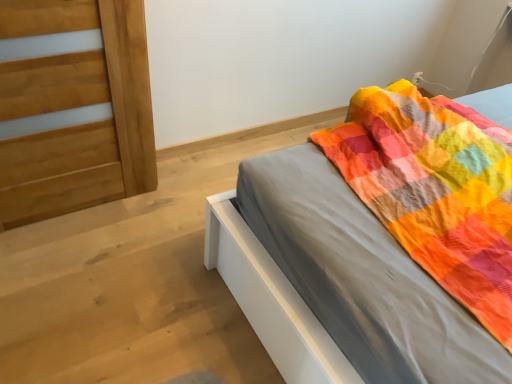
Identify the location of matte gray bed at center. The width and height of the screenshot is (512, 384). (337, 282).

The height and width of the screenshot is (384, 512). What do you see at coordinates (337, 282) in the screenshot?
I see `matte gray bed at center` at bounding box center [337, 282].

The image size is (512, 384). Find the location of `light brown wood door at left`. light brown wood door at left is located at coordinates (76, 107).

The height and width of the screenshot is (384, 512). What do you see at coordinates (76, 107) in the screenshot?
I see `light brown wood door at left` at bounding box center [76, 107].

This screenshot has width=512, height=384. Identify the location of matte gray bed at center. [337, 282].

Can you confirm if matte gray bed at center is positioned to the left of light brown wood door at left?

No, matte gray bed at center is not to the left of light brown wood door at left.

Relative to light brown wood door at left, is matte gray bed at center in front or behind?

Visually, matte gray bed at center is located in front of light brown wood door at left.

Which point is more distant from viewer, (245, 265) or (136, 76)?

Point (136, 76)

From the image's perspective, between matte gray bed at center and light brown wood door at left, which one is located above?

light brown wood door at left appears higher in the image.

From a real-world perspective, is matte gray bed at center located higher than light brown wood door at left?

No.

Can you confirm if matte gray bed at center is thinner than light brown wood door at left?

In fact, matte gray bed at center might be wider than light brown wood door at left.

Considering the sizes of objects matte gray bed at center and light brown wood door at left in the image provided, who is taller, matte gray bed at center or light brown wood door at left?

With more height is light brown wood door at left.

Consider the image. Is matte gray bed at center smaller than light brown wood door at left?

No.

Is matte gray bed at center situated inside light brown wood door at left or outside?

The correct answer is: outside.

Would you say matte gray bed at center is a long distance from light brown wood door at left?

That's not correct — matte gray bed at center is a little close to light brown wood door at left.

Consider the image. Does matte gray bed at center turn towards light brown wood door at left?

No, matte gray bed at center does not turn towards light brown wood door at left.

What's the angular difference between matte gray bed at center and light brown wood door at left's facing directions?

The facing directions of matte gray bed at center and light brown wood door at left are 90.9 degrees apart.

Where is `bed that is below the light brown wood door at left (from the image's perspective)`? Image resolution: width=512 pixels, height=384 pixels. bed that is below the light brown wood door at left (from the image's perspective) is located at coordinates (337, 282).

From the picture: Considering the relative positions of light brown wood door at left and matte gray bed at center in the image provided, is light brown wood door at left to the left of matte gray bed at center from the viewer's perspective?

Yes.

Between light brown wood door at left and matte gray bed at center, which one is positioned behind?

light brown wood door at left is behind.

Does point (34, 85) lie behind point (294, 368)?

Yes, it is.

From the image's perspective, which is below, light brown wood door at left or matte gray bed at center?

matte gray bed at center appears lower in the image.

From a real-world perspective, is light brown wood door at left over matte gray bed at center?

Yes, from a real-world perspective, light brown wood door at left is above matte gray bed at center.

From the picture: Considering the relative sizes of light brown wood door at left and matte gray bed at center in the image provided, is light brown wood door at left wider than matte gray bed at center?

Incorrect, the width of light brown wood door at left does not surpass that of matte gray bed at center.

In terms of height, does light brown wood door at left look taller or shorter compared to matte gray bed at center?

light brown wood door at left is taller than matte gray bed at center.

Consider the image. Which of these two, light brown wood door at left or matte gray bed at center, is smaller?

Smaller between the two is light brown wood door at left.

Do you think light brown wood door at left is within matte gray bed at center, or outside of it?

The correct answer is: outside.

Is light brown wood door at left in contact with matte gray bed at center?

No, light brown wood door at left is not touching matte gray bed at center.

Is light brown wood door at left oriented towards matte gray bed at center?

No, light brown wood door at left is not oriented towards matte gray bed at center.

Locate an element on the screen. Image resolution: width=512 pixels, height=384 pixels. door that is on the left side of matte gray bed at center is located at coordinates (76, 107).

You are a GUI agent. You are given a task and a screenshot of the screen. Output one action in this format:
    pyautogui.click(x=<x>, y=<y>)
    Task: Click on the door behind the matte gray bed at center
    
    Given the screenshot: What is the action you would take?
    pyautogui.click(x=76, y=107)

Find the location of a particular element. Image resolution: width=512 pixels, height=384 pixels. bed that is below the light brown wood door at left (from the image's perspective) is located at coordinates (337, 282).